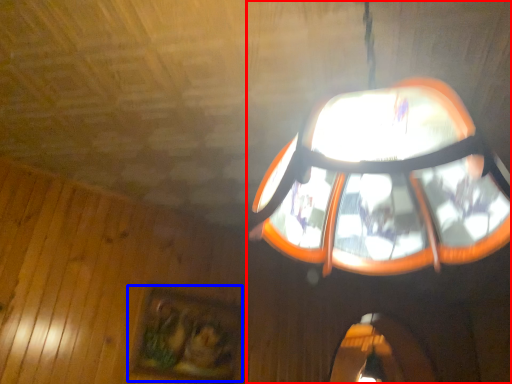
Question: Which point is closer to the camera, lamp (highlighted by a red box) or picture frame (highlighted by a blue box)?

Choices:
 (A) lamp
 (B) picture frame

Answer: (A)